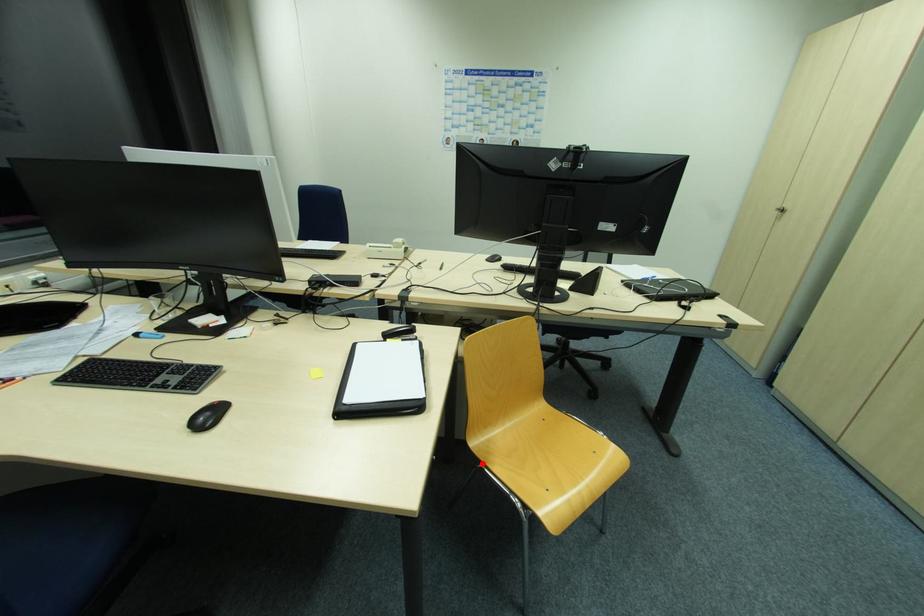
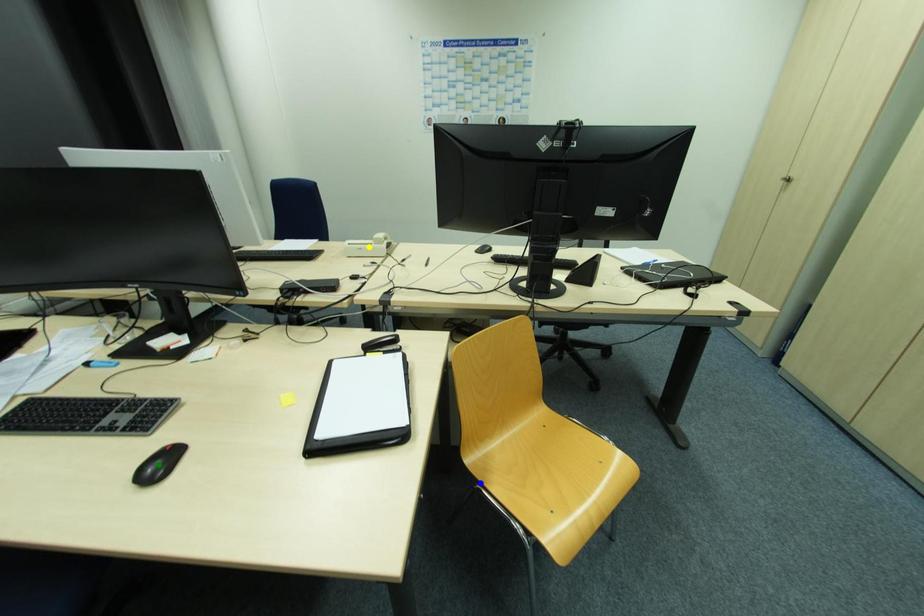
Question: I am providing you with two images of the same scene from different viewpoints. A red point is marked on the first image. You are given multiple points on the second image. In image 2, which mark is for the same physical point as the one in image 1?

Choices:
 (A) green point
 (B) blue point
 (C) yellow point

Answer: (B)